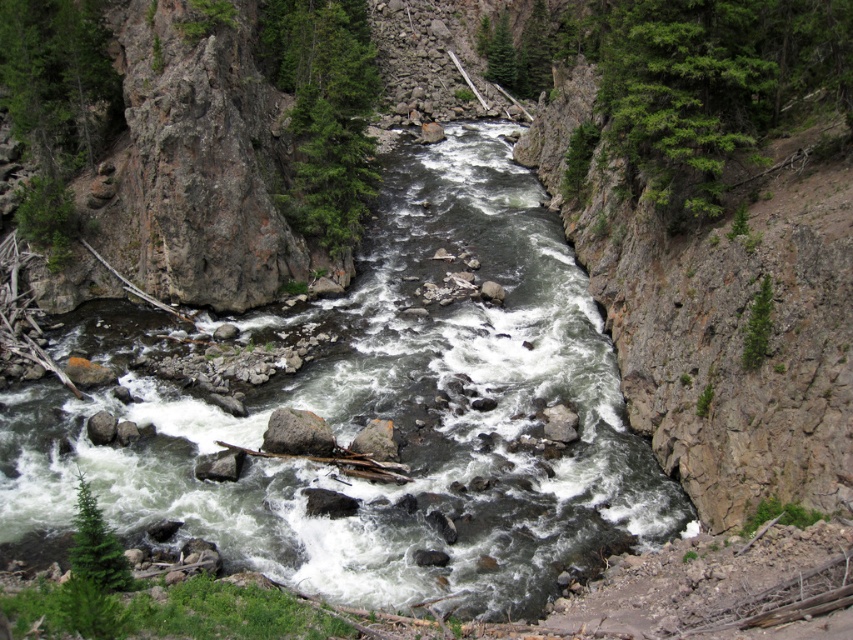
What do you see at coordinates (323, 109) in the screenshot?
I see `green textured tree at upper center` at bounding box center [323, 109].

Is green textured tree at upper center wider than gray rough rock at center?

Indeed, green textured tree at upper center has a greater width compared to gray rough rock at center.

Which is behind, point (364, 38) or point (328, 433)?

The point (364, 38) is behind.

Where is `green textured tree at upper center`? This screenshot has height=640, width=853. green textured tree at upper center is located at coordinates (323, 109).

Can you confirm if green rock stream at center is positioned to the left of green textured tree at upper center?

Incorrect, green rock stream at center is not on the left side of green textured tree at upper center.

Is green rock stream at center smaller than green textured tree at upper center?

Actually, green rock stream at center might be larger than green textured tree at upper center.

At what (x,y) coordinates should I click in order to perform the action: click on green rock stream at center. Please return your answer as a coordinate pair (x, y). Looking at the image, I should click on (389, 413).

Locate an element on the screen. The height and width of the screenshot is (640, 853). green rock stream at center is located at coordinates (389, 413).

The height and width of the screenshot is (640, 853). I want to click on green textured tree at upper right, so click(x=709, y=83).

Does green textured tree at upper right appear over green textured tree at upper center?

Incorrect, green textured tree at upper right is not positioned above green textured tree at upper center.

Does point (605, 109) come behind point (328, 108)?

Yes.

Locate an element on the screen. green textured tree at upper right is located at coordinates (709, 83).